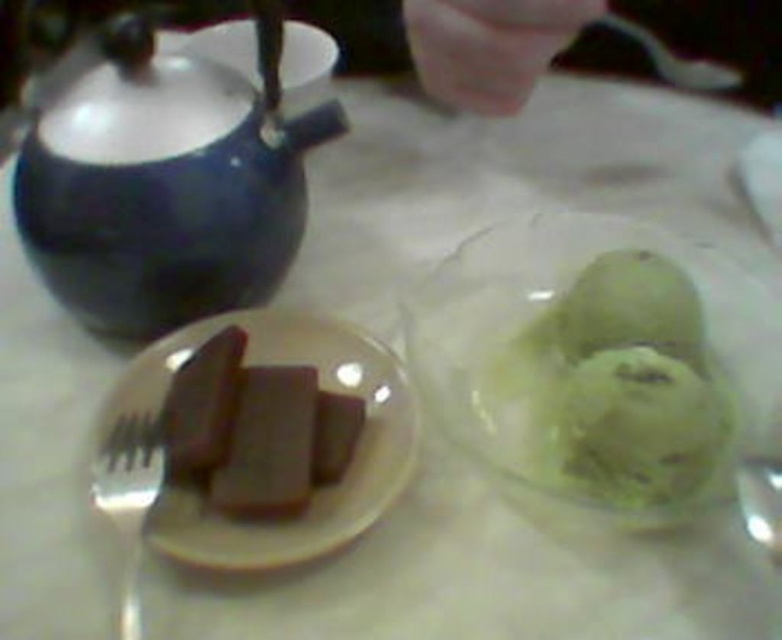
Question: Can you confirm if matte black teapot at upper left is positioned to the left of dark brown chocolate at center?

Choices:
 (A) yes
 (B) no

Answer: (A)

Question: Considering the real-world distances, which object is farthest from the matte black teapot at upper left?

Choices:
 (A) matte brown chocolate at left
 (B) dark brown chocolate at center

Answer: (B)

Question: Which object is closer to the camera taking this photo?

Choices:
 (A) metallic spoon at upper right
 (B) matte black teapot at upper left

Answer: (B)

Question: Is matte black teapot at upper left behind green matte ice cream at right?

Choices:
 (A) no
 (B) yes

Answer: (B)

Question: Is silver metallic fork at lower left to the left of metallic spoon at upper right from the viewer's perspective?

Choices:
 (A) yes
 (B) no

Answer: (A)

Question: Based on their relative distances, which object is nearer to the matte black teapot at upper left?

Choices:
 (A) silver metallic fork at lower left
 (B) metallic spoon at upper right
 (C) dark brown chocolate at center
 (D) matte brown chocolate at left

Answer: (D)